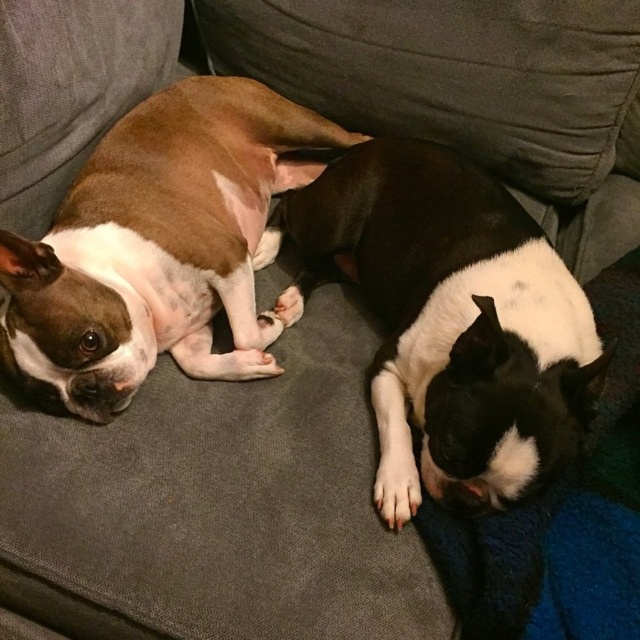
Which of these two, black/white fur dog at lower right or brown matte dog at left, stands shorter?

black/white fur dog at lower right is shorter.

Between point (536, 340) and point (44, 243), which one is positioned behind?

Point (44, 243)

Who is more forward, [358,166] or [48,340]?

Point [48,340] is more forward.

Locate an element on the screen. This screenshot has height=640, width=640. black/white fur dog at lower right is located at coordinates (449, 321).